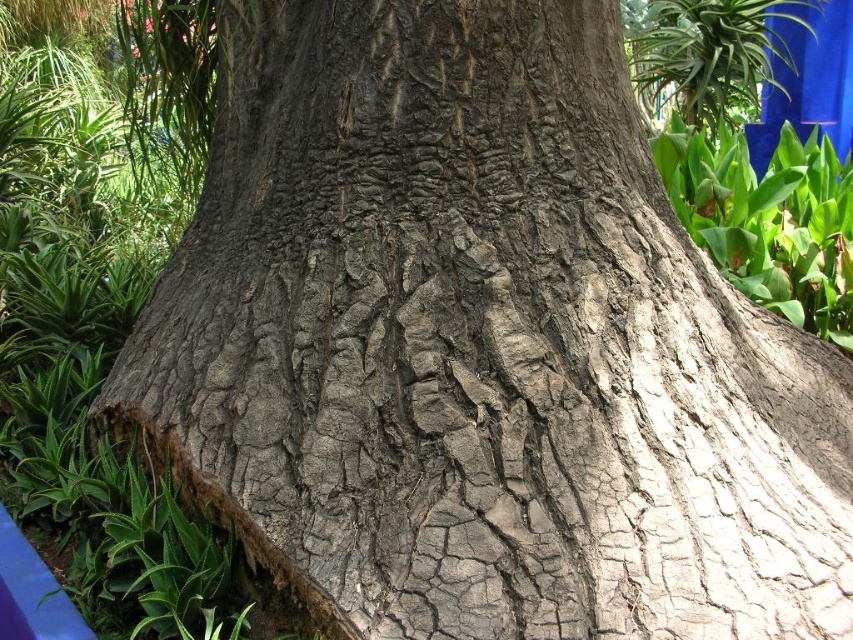
Question: Does green leafy plant at right have a smaller size compared to green leafy plant at upper right?

Choices:
 (A) no
 (B) yes

Answer: (A)

Question: Is green leafy plant at right wider than green leafy plant at upper right?

Choices:
 (A) no
 (B) yes

Answer: (B)

Question: Which point is farther to the camera?

Choices:
 (A) (680, 198)
 (B) (672, 61)

Answer: (B)

Question: Does green leafy plant at right appear over green leafy plant at upper right?

Choices:
 (A) no
 (B) yes

Answer: (A)

Question: Which object is closer to the camera taking this photo?

Choices:
 (A) green leafy plant at right
 (B) green leafy plant at upper right

Answer: (A)